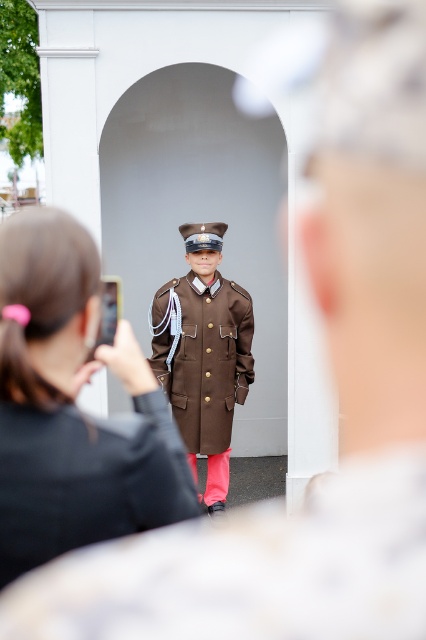
What is the color of the hair at the point with coordinates (72, 406)?

The point at coordinates (72, 406) is on matte black hair at center.

You are a photographer trying to capture the best shot of the matte black hair at center and the brown matte uniform at center. Based on their sizes, which one should you focus on to ensure it fits entirely within your camera frame?

The matte black hair at center has a lesser width compared to the brown matte uniform at center, so you should focus on the brown matte uniform at center to ensure it fits entirely within your camera frame since it is wider.